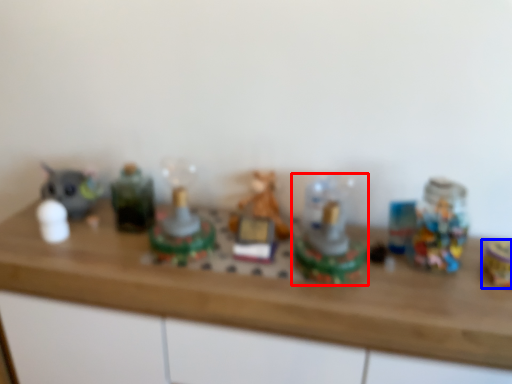
Question: Which object appears farthest to the camera in this image, toy (highlighted by a red box) or toy (highlighted by a blue box)?

Choices:
 (A) toy
 (B) toy

Answer: (B)